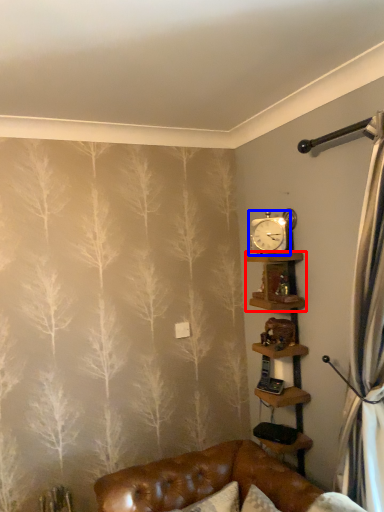
Question: Which point is closer to the camera, shelf (highlighted by a red box) or clock (highlighted by a blue box)?

Choices:
 (A) shelf
 (B) clock

Answer: (A)